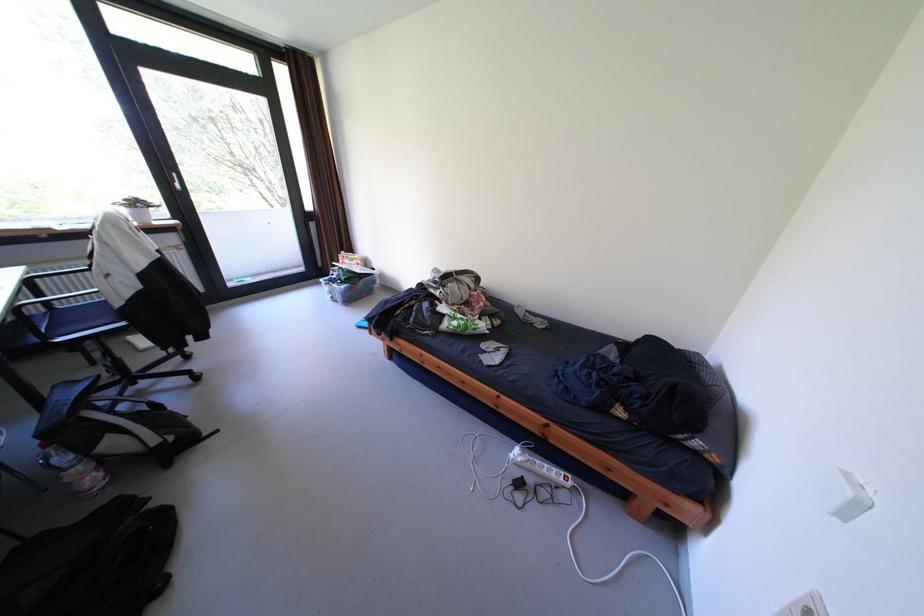
I want to click on silver door handle, so click(x=175, y=180).